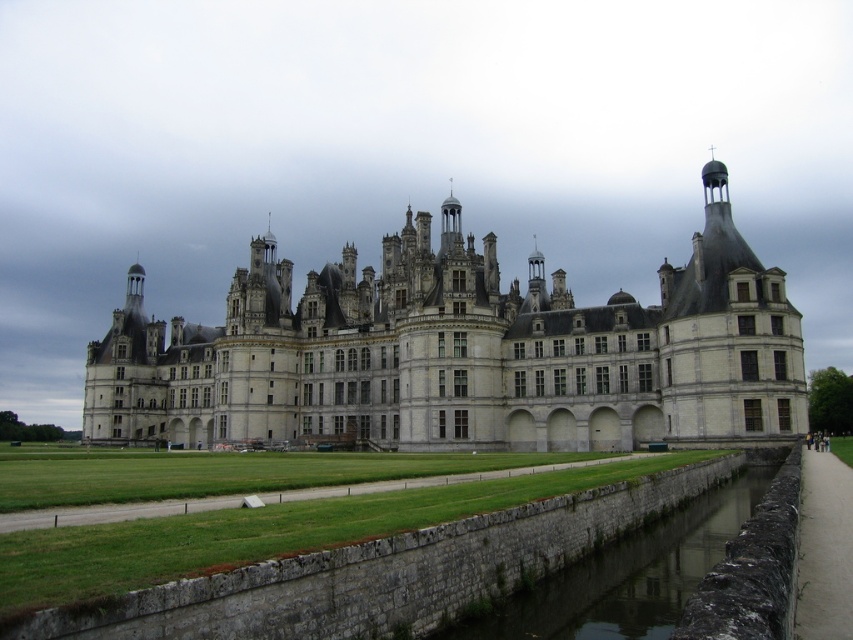
You are standing at the point marked by the coordinates point (461,353) in the image. What structure are you directly facing?

The point (461,353) marks the gray stone castle at center, so you are directly facing the gray stone castle at center.

You are a tour guide explaining the castle layout to visitors. You mention the gray stone castle at center and the gray stone wall at lower center. Which one is wider?

The gray stone castle at center is wider than the gray stone wall at lower center.

You are a tourist standing at the edge of the canal near the gray stone wall at lower center. You want to take a photo of the gray stone castle at center. Which object should you move closer to in order to capture the entire structure in your camera frame?

You should move closer to the gray stone wall at lower center because the gray stone castle at center is larger in size than the gray stone wall at lower center, so increasing the distance from the castle might help fit its entire structure into the frame.